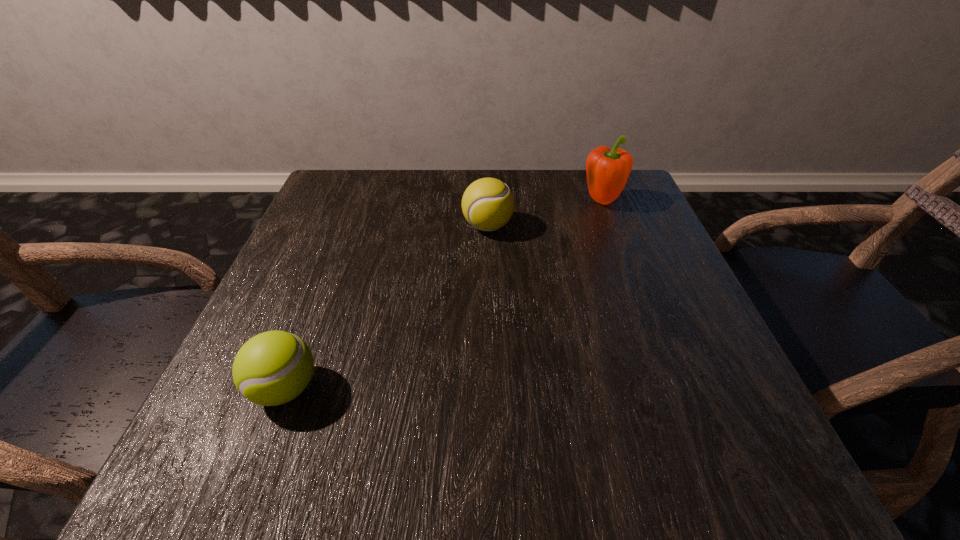
The height and width of the screenshot is (540, 960). What are the coordinates of `free spot between the leftmost object and the pepper` in the screenshot? It's located at (444, 295).

I want to click on vacant area between the second object from left to right and the tallest object, so click(545, 214).

I want to click on free space between the tallest object and the second object from left to right, so 545,214.

Image resolution: width=960 pixels, height=540 pixels. I want to click on free space between the leftmost object and the right tennis ball, so click(x=386, y=308).

I want to click on free space that is in between the second object from right to left and the tallest object, so click(x=545, y=214).

Find the location of a particular element. This screenshot has width=960, height=540. vacant area that lies between the farther tennis ball and the pepper is located at coordinates (545, 214).

The width and height of the screenshot is (960, 540). Identify the location of free space between the farther tennis ball and the nearer tennis ball. (386, 308).

The width and height of the screenshot is (960, 540). Find the location of `free space between the second object from right to left and the pepper`. free space between the second object from right to left and the pepper is located at coordinates (545, 214).

You are a GUI agent. You are given a task and a screenshot of the screen. Output one action in this format:
    pyautogui.click(x=<x>, y=<y>)
    Task: Click on the vacant space in between the left tennis ball and the right tennis ball
    
    Given the screenshot: What is the action you would take?
    pyautogui.click(x=386, y=308)

The height and width of the screenshot is (540, 960). Find the location of `free space that is in between the nearer tennis ball and the second object from left to right`. free space that is in between the nearer tennis ball and the second object from left to right is located at coordinates (386, 308).